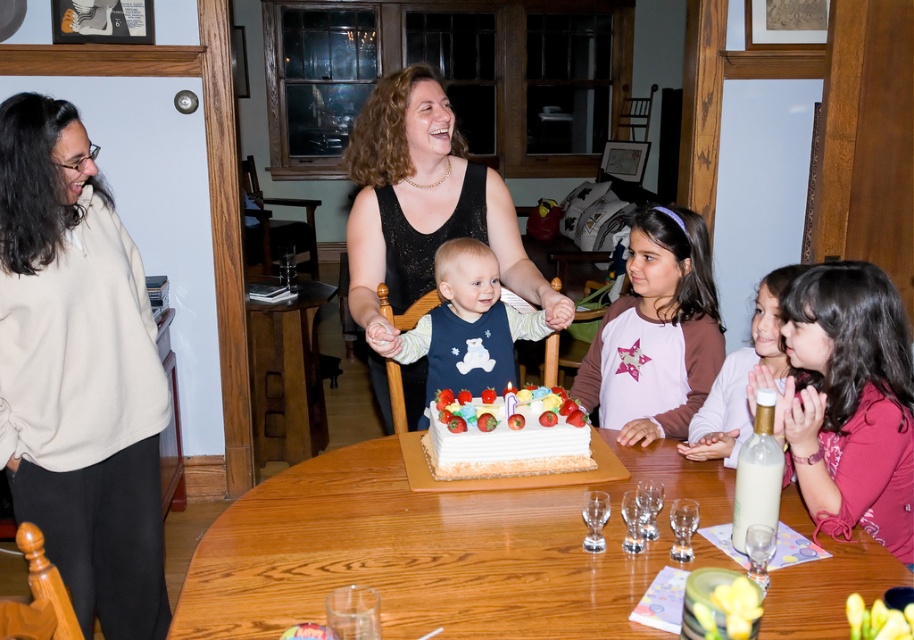
You are organizing a closet and need to hang the white fleece sweater at left and the pink fabric shirt at right. According to the image, which one should be placed lower on the hanger?

The white fleece sweater at left should be placed lower on the hanger because it is positioned under the pink fabric shirt at right in the image.